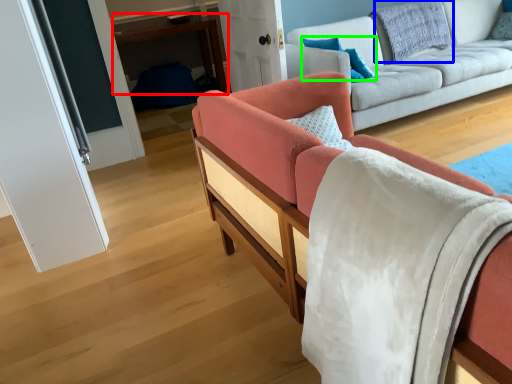
Question: Which is nearer to the table (highlighted by a red box)? pillow (highlighted by a blue box) or pillow (highlighted by a green box).

Choices:
 (A) pillow
 (B) pillow

Answer: (A)